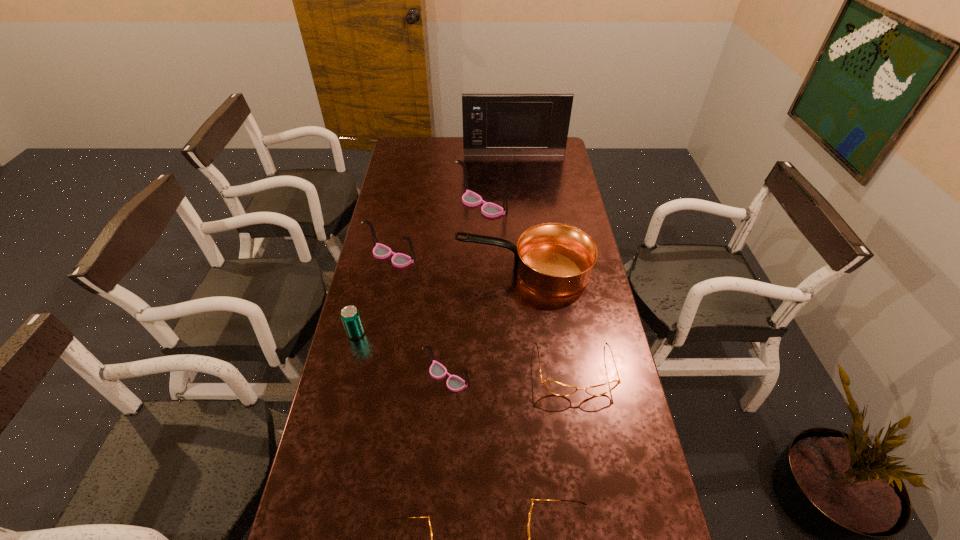
This screenshot has height=540, width=960. In order to click on dark microwave oven in this screenshot , I will do `click(494, 124)`.

This screenshot has width=960, height=540. What are the coordinates of `microwave oven` in the screenshot? It's located at (494, 124).

I want to click on the farthest spectacles, so click(x=469, y=198).

This screenshot has height=540, width=960. In order to click on the farthest pink spectacles in this screenshot , I will do `click(469, 198)`.

The height and width of the screenshot is (540, 960). Identify the location of frying pan. (555, 259).

This screenshot has width=960, height=540. I want to click on the leftmost pink spectacles, so click(x=380, y=251).

This screenshot has width=960, height=540. Identify the location of the fifth nearest spectacles. (380, 251).

You are a GUI agent. You are given a task and a screenshot of the screen. Output one action in this format:
    pyautogui.click(x=<x>, y=<y>)
    Task: Click on the nearest pink spectacles
    
    Given the screenshot: What is the action you would take?
    pyautogui.click(x=454, y=383)

At what (x,y) coordinates should I click in order to perform the action: click on the smallest pink spectacles. Please return your answer as a coordinate pair (x, y). Looking at the image, I should click on (454, 383).

Where is `the fifth farthest object`? Image resolution: width=960 pixels, height=540 pixels. the fifth farthest object is located at coordinates (350, 316).